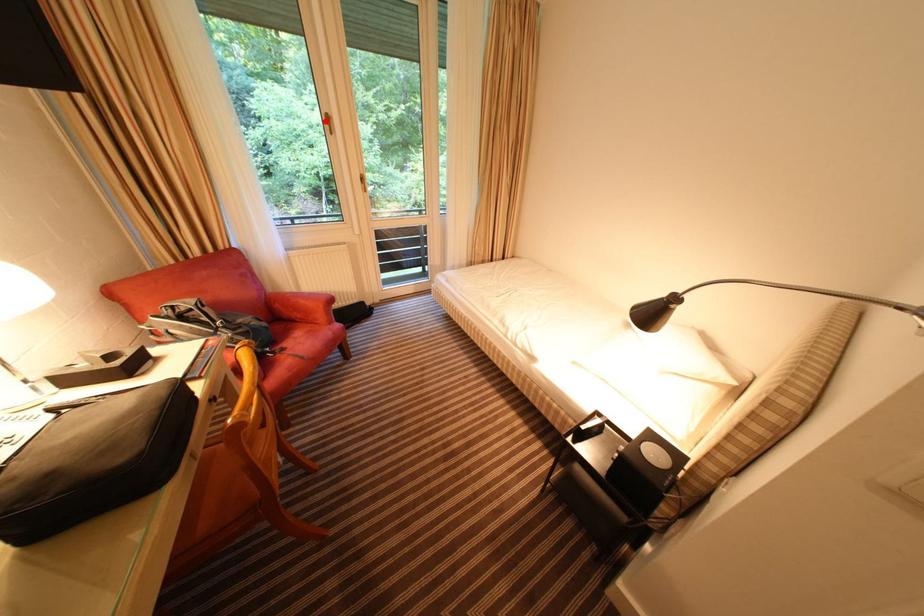
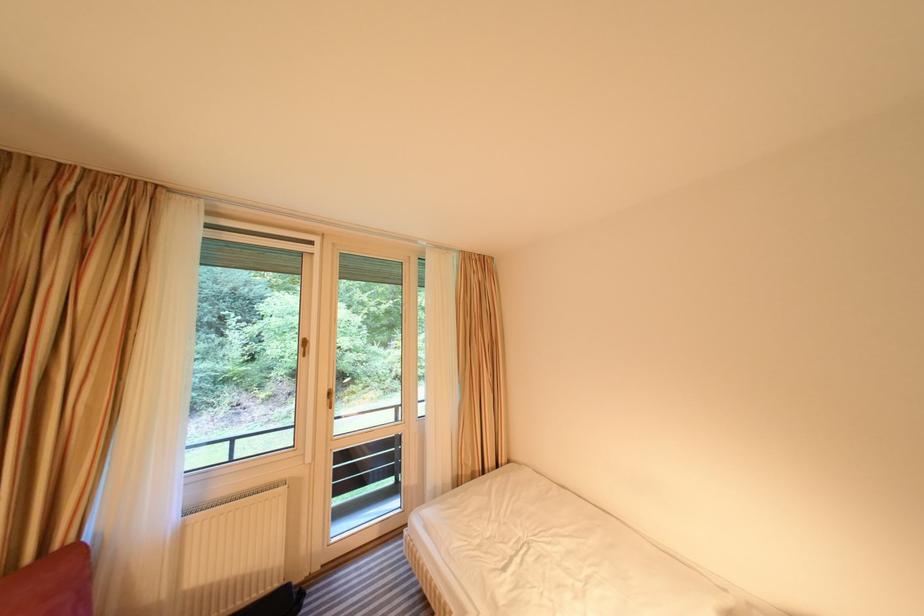
Question: I am providing you with two images of the same scene from different viewpoints. Given a red point in image1, look at the same physical point in image2. Is it:

Choices:
 (A) Closer to the viewpoint
 (B) Farther from the viewpoint

Answer: (A)